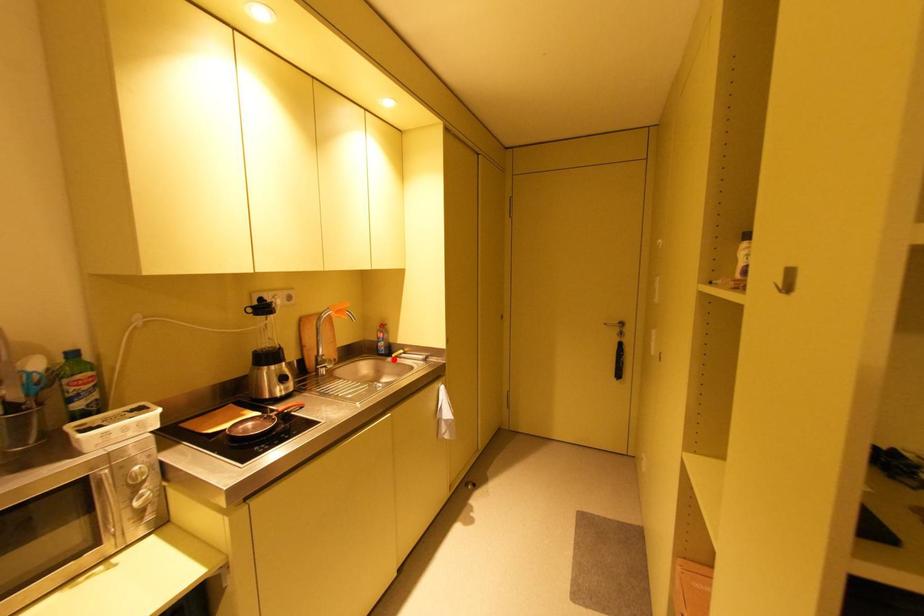
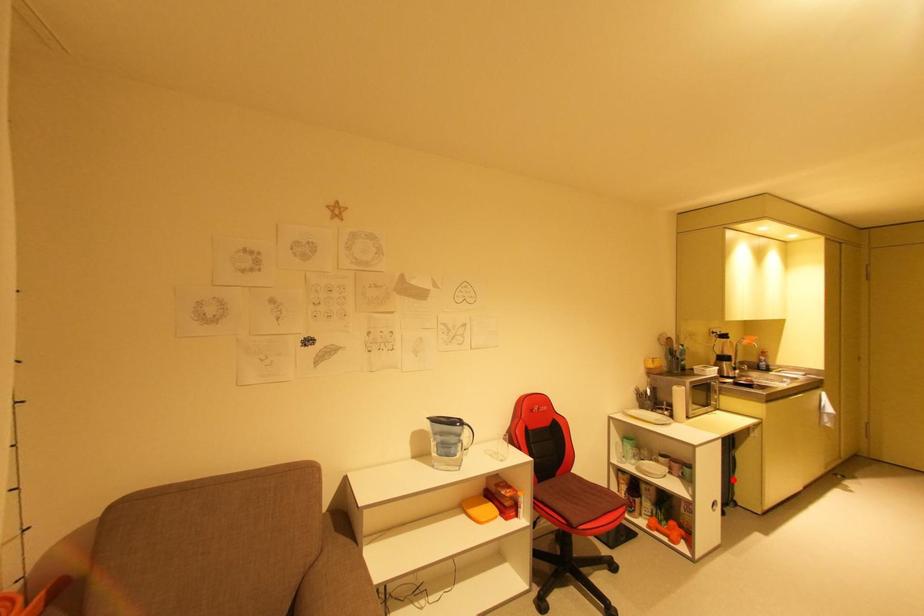
I am providing you with two images of the same scene from different viewpoints. A red point is marked on the first image and another point is marked on the second image. Do the highlighted points in image1 and image2 indicate the same real-world spot?

No